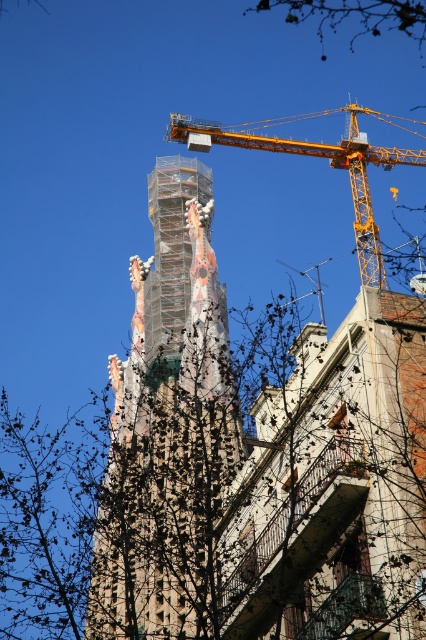
Question: Can you confirm if multicolored mosaic tower at center is bigger than yellow metallic crane at upper center?

Choices:
 (A) yes
 (B) no

Answer: (B)

Question: Among these objects, which one is farthest from the camera?

Choices:
 (A) yellow metallic crane at upper center
 (B) bare branches at upper center
 (C) multicolored mosaic tower at center

Answer: (B)

Question: Among these points, which one is nearest to the camera?

Choices:
 (A) pos(328,22)
 (B) pos(363,211)
 (C) pos(175,397)

Answer: (C)

Question: Which of the following is the farthest from the observer?

Choices:
 (A) multicolored mosaic tower at center
 (B) yellow metallic crane at upper center
 (C) bare branches at upper center

Answer: (C)

Question: Can you confirm if multicolored mosaic tower at center is positioned above yellow metallic crane at upper center?

Choices:
 (A) no
 (B) yes

Answer: (A)

Question: In this image, where is yellow metallic crane at upper center located relative to bare branches at upper center?

Choices:
 (A) left
 (B) right

Answer: (A)